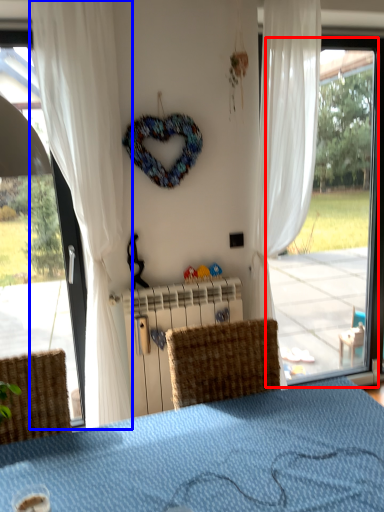
Question: Among these objects, which one is nearest to the camera, window (highlighted by a red box) or curtain (highlighted by a blue box)?

Choices:
 (A) window
 (B) curtain

Answer: (B)